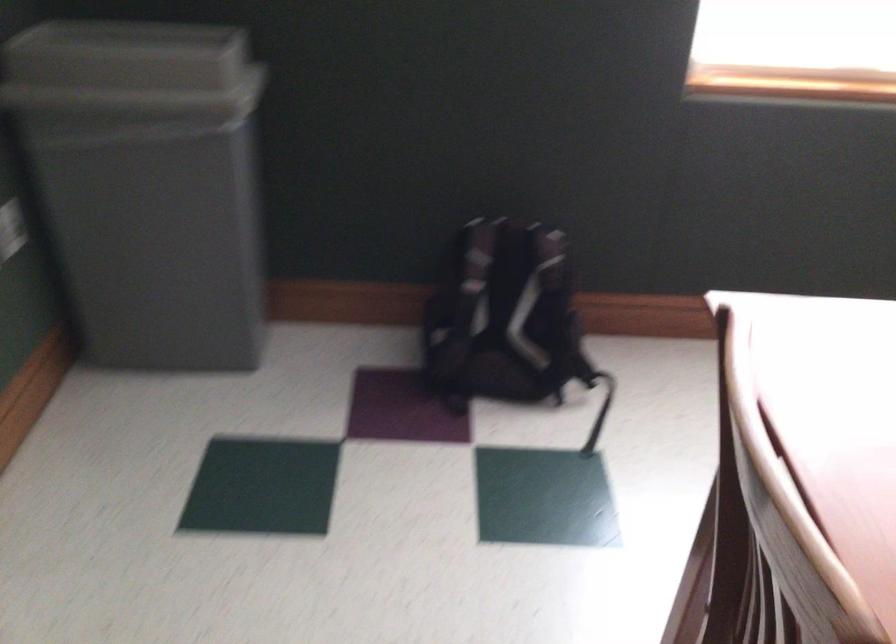
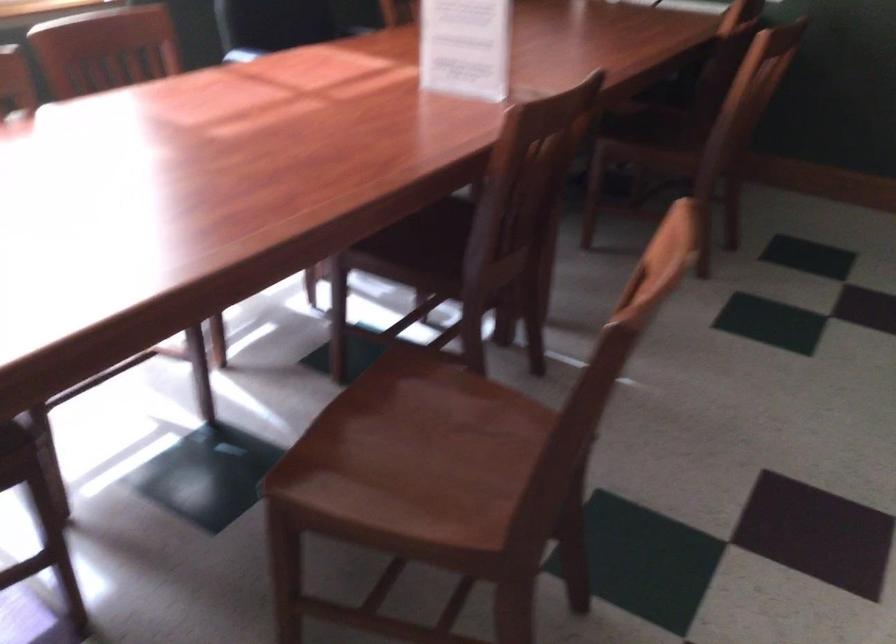
Question: Based on the continuous images, in which direction is the camera rotating? Reply with the corresponding letter.

Choices:
 (A) Left
 (B) Right
 (C) Up
 (D) Down

Answer: (B)